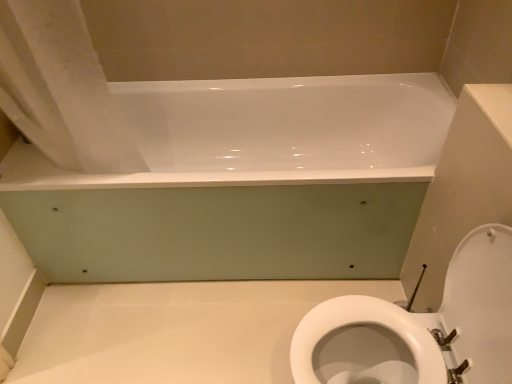
I want to click on white glossy bathtub at upper center, so click(x=242, y=183).

Image resolution: width=512 pixels, height=384 pixels. What do you see at coordinates (61, 88) in the screenshot?
I see `white fabric shower curtain at upper left` at bounding box center [61, 88].

Find the location of `white glossy toilet at lower right`. white glossy toilet at lower right is located at coordinates (419, 327).

Is white glossy bathtub at upper center wider than white glossy toilet at lower right?

Correct, the width of white glossy bathtub at upper center exceeds that of white glossy toilet at lower right.

Which point is more distant from viewer, [136,233] or [490,310]?

The point [136,233] is behind.

Is there a large distance between white glossy bathtub at upper center and white glossy toilet at lower right?

That's not correct — white glossy bathtub at upper center is a little close to white glossy toilet at lower right.

Is white glossy toilet at lower right outside of white fabric shower curtain at upper left?

Yes, white glossy toilet at lower right is outside of white fabric shower curtain at upper left.

Could you measure the distance between white glossy toilet at lower right and white fabric shower curtain at upper left?

The distance of white glossy toilet at lower right from white fabric shower curtain at upper left is 99.85 centimeters.

Does white glossy toilet at lower right have a greater width compared to white fabric shower curtain at upper left?

Indeed, white glossy toilet at lower right has a greater width compared to white fabric shower curtain at upper left.

From the image's perspective, is white glossy toilet at lower right located beneath white fabric shower curtain at upper left?

Yes, from the image's perspective, white glossy toilet at lower right is beneath white fabric shower curtain at upper left.

Based on their positions, is white glossy bathtub at upper center located to the left or right of white fabric shower curtain at upper left?

white glossy bathtub at upper center is positioned on white fabric shower curtain at upper left's right side.

Is point (432, 110) closer or farther from the camera than point (93, 79)?

Point (432, 110) is farther from the camera than point (93, 79).

How many degrees apart are the facing directions of white glossy bathtub at upper center and white fabric shower curtain at upper left?

They differ by 0.000602 degrees in their facing directions.

At what (x,y) coordinates should I click in order to perform the action: click on shower curtain to the left of white glossy bathtub at upper center. Please return your answer as a coordinate pair (x, y). The height and width of the screenshot is (384, 512). Looking at the image, I should click on (61, 88).

From the image's perspective, is white glossy toilet at lower right over white glossy bathtub at upper center?

No, from the image's perspective, white glossy toilet at lower right is not over white glossy bathtub at upper center.

Find the location of `bathtub that is on the left side of white glossy toilet at lower right`. bathtub that is on the left side of white glossy toilet at lower right is located at coordinates (242, 183).

Is white glossy toilet at lower right not inside white glossy bathtub at upper center?

Yes.

Is white glossy toilet at lower right in front of white glossy bathtub at upper center?

Yes, it is in front of white glossy bathtub at upper center.

Considering the relative sizes of white fabric shower curtain at upper left and white glossy toilet at lower right in the image provided, is white fabric shower curtain at upper left wider than white glossy toilet at lower right?

No, white fabric shower curtain at upper left is not wider than white glossy toilet at lower right.

Is white glossy toilet at lower right at the back of white fabric shower curtain at upper left?

white fabric shower curtain at upper left does not have its back to white glossy toilet at lower right.

Is white fabric shower curtain at upper left bigger or smaller than white glossy toilet at lower right?

white fabric shower curtain at upper left is smaller than white glossy toilet at lower right.

Is white fabric shower curtain at upper left positioned far away from white glossy bathtub at upper center?

No, white fabric shower curtain at upper left is not far away from white glossy bathtub at upper center.

Is white fabric shower curtain at upper left positioned with its back to white glossy bathtub at upper center?

No, white fabric shower curtain at upper left is not facing away from white glossy bathtub at upper center.

Is white fabric shower curtain at upper left thinner than white glossy bathtub at upper center?

Yes.

Consider the image. Is white fabric shower curtain at upper left positioned behind white glossy bathtub at upper center?

No.

This screenshot has width=512, height=384. I want to click on toilet on the right of white glossy bathtub at upper center, so click(419, 327).

This screenshot has width=512, height=384. In the image, there is a white glossy toilet at lower right. Find the location of `shower curtain above it (from the image's perspective)`. shower curtain above it (from the image's perspective) is located at coordinates (61, 88).

Estimate the real-world distances between objects in this image. Which object is closer to white glossy toilet at lower right, white glossy bathtub at upper center or white fabric shower curtain at upper left?

white glossy bathtub at upper center.

In the scene shown: Which object lies nearer to the anchor point white fabric shower curtain at upper left, white glossy bathtub at upper center or white glossy toilet at lower right?

white glossy bathtub at upper center is closer to white fabric shower curtain at upper left.

Which object lies further to the anchor point white fabric shower curtain at upper left, white glossy toilet at lower right or white glossy bathtub at upper center?

white glossy toilet at lower right is positioned further to the anchor white fabric shower curtain at upper left.

Which object lies nearer to the anchor point white glossy toilet at lower right, white fabric shower curtain at upper left or white glossy bathtub at upper center?

Among the two, white glossy bathtub at upper center is located nearer to white glossy toilet at lower right.

Considering their positions, is white glossy toilet at lower right positioned closer to white glossy bathtub at upper center than white fabric shower curtain at upper left?

The object closer to white glossy bathtub at upper center is white fabric shower curtain at upper left.

Considering their positions, is white fabric shower curtain at upper left positioned further to white glossy bathtub at upper center than white glossy toilet at lower right?

white glossy toilet at lower right is positioned further to the anchor white glossy bathtub at upper center.

Locate an element on the screen. bathtub between white fabric shower curtain at upper left and white glossy toilet at lower right is located at coordinates (242, 183).